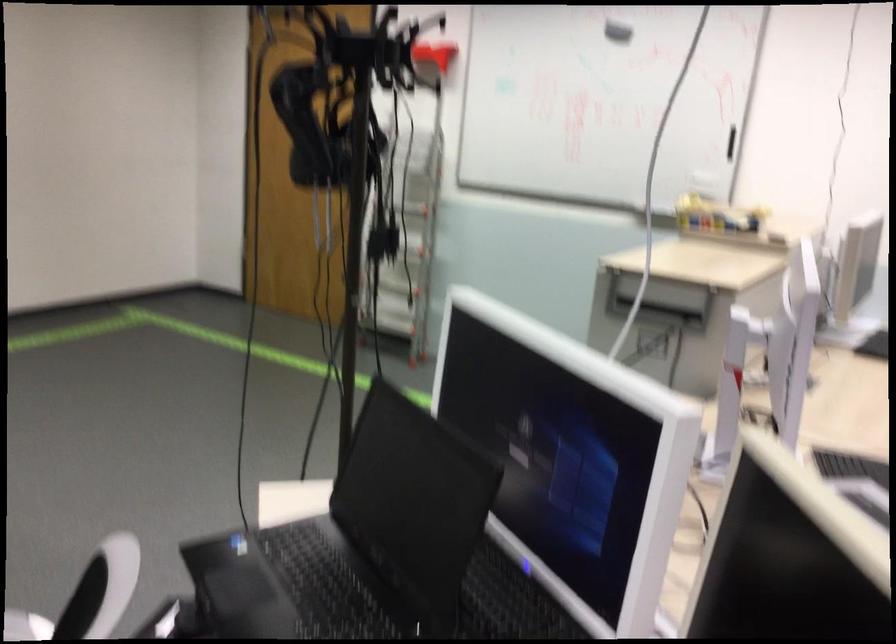
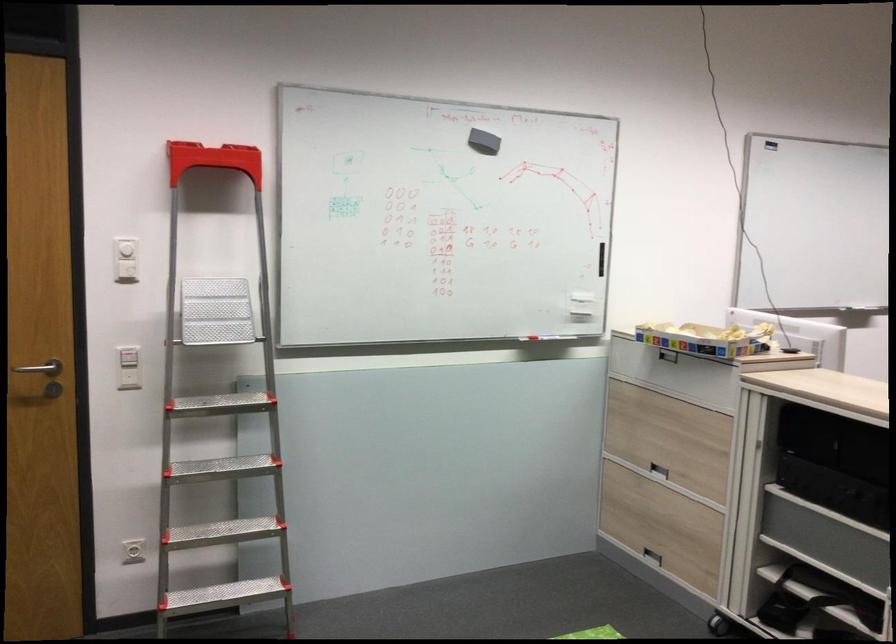
Question: I am providing you with two images of the same scene from different viewpoints. After the viewpoint changes to image2, which objects are now occluded?

Choices:
 (A) white  wall button
 (B) white wall dial
 (C) recessed drawer handle
 (D) none of these

Answer: (D)